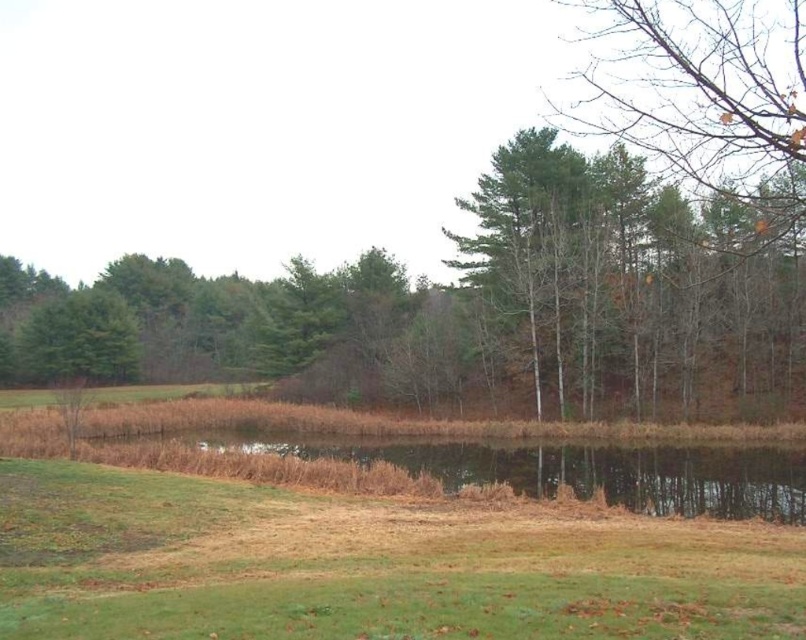
You are standing at the edge of the scene and want to walk towards the brown grassy lake at center. Which direction should you move relative to the green grassy at lower left?

You should move to the right of the green grassy at lower left to reach the brown grassy lake at center since the green grassy at lower left is positioned to the left of the brown grassy lake at center.

You are standing at the center of the image and want to walk to the water edge. Which direction should you move to reach the green grassy at lower left first?

Since the green grassy at lower left is located at coordinates approximately 0.886 on the x and 0.455 on the y axis, you should move towards the lower left direction to reach it first before the water edge.